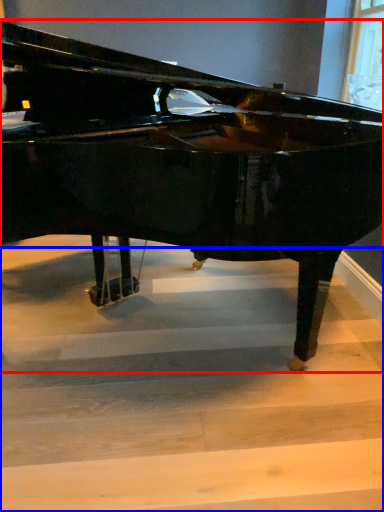
Question: Which object is further to the camera taking this photo, piano (highlighted by a red box) or stairwell (highlighted by a blue box)?

Choices:
 (A) piano
 (B) stairwell

Answer: (B)